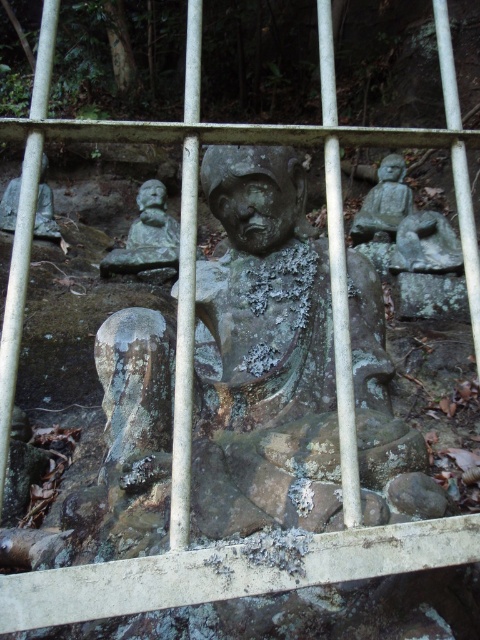
Can you confirm if green patina stone statue at center is taller than green mossy rock at center?

Indeed, green patina stone statue at center has a greater height compared to green mossy rock at center.

Does green patina stone statue at center appear on the left side of green mossy rock at center?

Correct, you'll find green patina stone statue at center to the left of green mossy rock at center.

Describe the element at coordinates (263, 353) in the screenshot. I see `green patina stone statue at center` at that location.

You are a GUI agent. You are given a task and a screenshot of the screen. Output one action in this format:
    pyautogui.click(x=<x>, y=<y>)
    Task: Click on the green patina stone statue at center
    This screenshot has height=640, width=480.
    Given the screenshot: What is the action you would take?
    pyautogui.click(x=263, y=353)

In the scene shown: How distant is smooth gray stone statue at right from matte gray statue at left?

1.54 meters

Does smooth gray stone statue at right have a greater height compared to matte gray statue at left?

Incorrect, smooth gray stone statue at right's height is not larger of matte gray statue at left's.

Locate an element on the screen. Image resolution: width=480 pixels, height=640 pixels. smooth gray stone statue at right is located at coordinates (384, 204).

From the picture: Is green mossy rock at center smaller than matte gray statue at left?

Correct, green mossy rock at center occupies less space than matte gray statue at left.

Can you confirm if green mossy rock at center is positioned below matte gray statue at left?

Correct, green mossy rock at center is located below matte gray statue at left.

Who is more forward, (443, 285) or (44, 154)?

Point (44, 154)

This screenshot has height=640, width=480. I want to click on green mossy rock at center, so click(x=430, y=296).